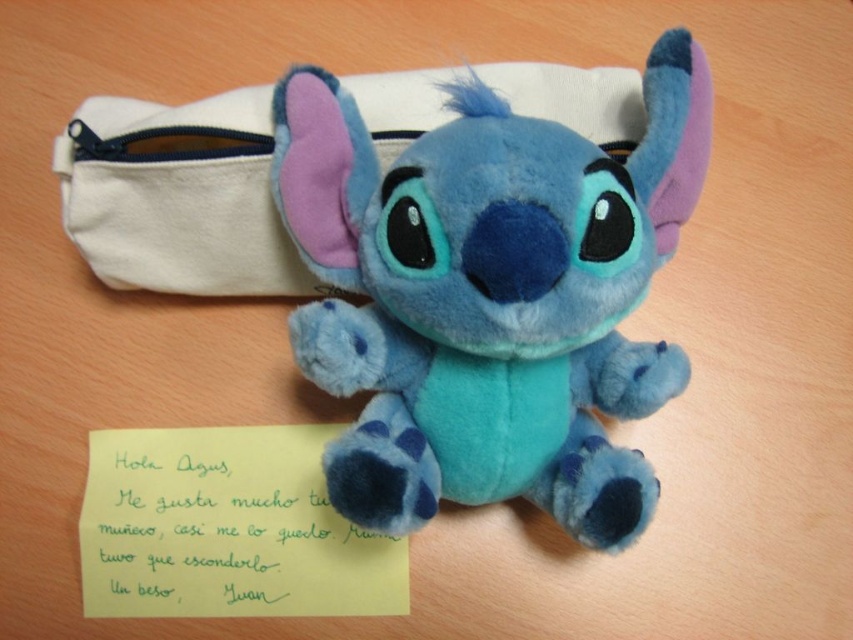
Question: Is soft blue plush toy at center wider than white canvas pouch at upper center?

Choices:
 (A) no
 (B) yes

Answer: (A)

Question: Which of the following is the closest to the observer?

Choices:
 (A) white canvas pouch at upper center
 (B) yellow paper at center

Answer: (A)

Question: Is soft blue plush toy at center thinner than white canvas pouch at upper center?

Choices:
 (A) yes
 (B) no

Answer: (A)

Question: Estimate the real-world distances between objects in this image. Which object is farther from the yellow paper at center?

Choices:
 (A) white canvas pouch at upper center
 (B) soft blue plush toy at center

Answer: (A)

Question: Does white canvas pouch at upper center come behind yellow paper at center?

Choices:
 (A) no
 (B) yes

Answer: (A)

Question: Which point is farther to the camera?

Choices:
 (A) (358, 371)
 (B) (488, 70)

Answer: (B)